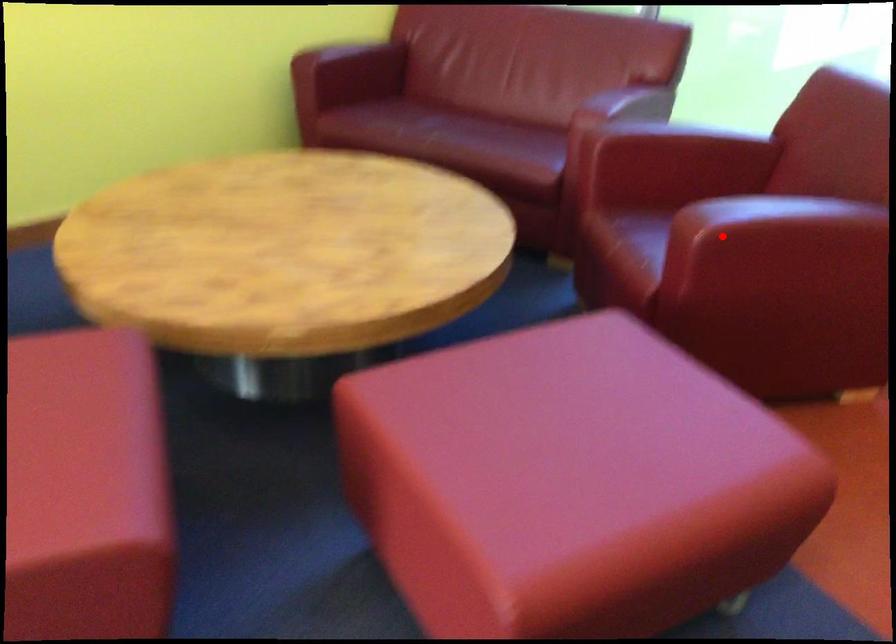
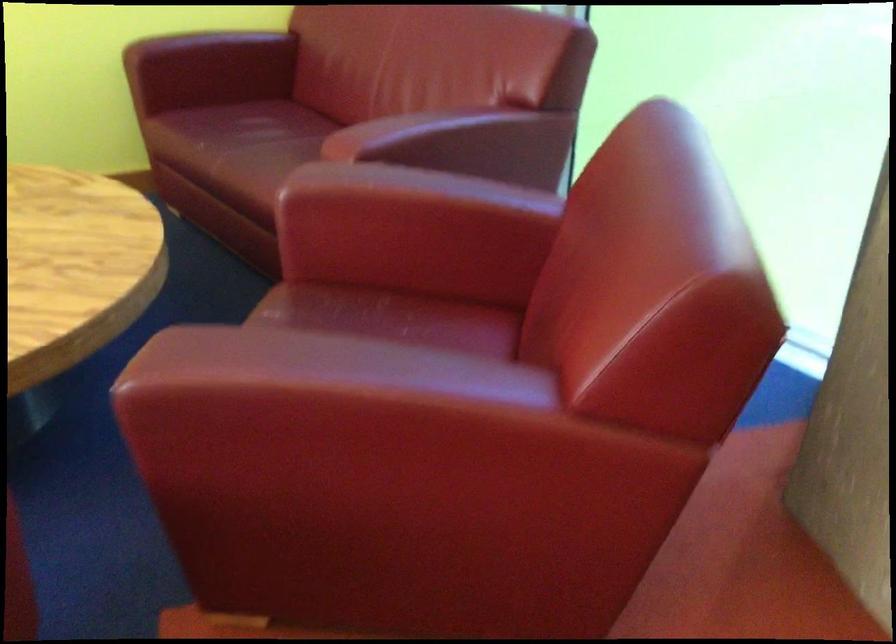
Locate, in the second image, the point that corresponds to the highlighted location in the first image.

(177, 386)